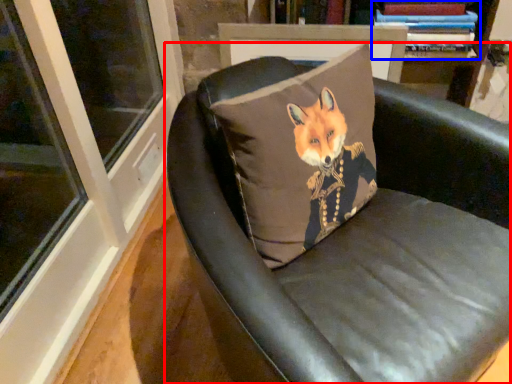
Question: Among these objects, which one is farthest to the camera, chair (highlighted by a red box) or book (highlighted by a blue box)?

Choices:
 (A) chair
 (B) book

Answer: (B)